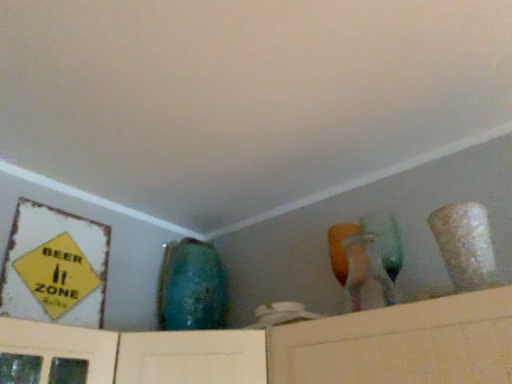
Locate an element on the screen. yellow paper sign at left is located at coordinates (57, 275).

Image resolution: width=512 pixels, height=384 pixels. Describe the element at coordinates (57, 275) in the screenshot. I see `yellow paper sign at left` at that location.

The image size is (512, 384). What are the coordinates of `yellow paper sign at left` in the screenshot? It's located at (57, 275).